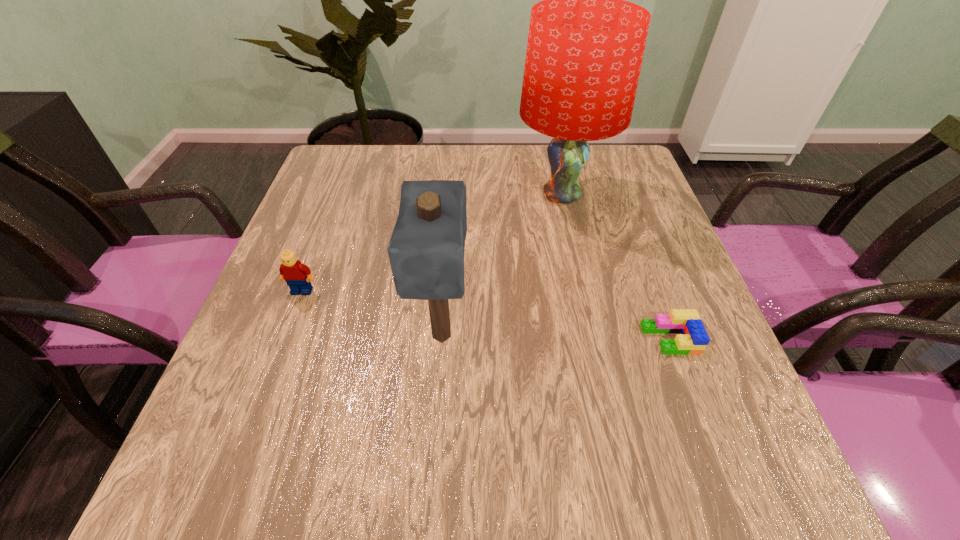
Image resolution: width=960 pixels, height=540 pixels. In order to click on free region located on the front-facing side of the second farthest object in this screenshot , I will do point(275,363).

I want to click on free space located on the front of the shortest object, so click(722, 481).

Find the location of a particular element. object that is positioned at the far edge is located at coordinates (585, 48).

The image size is (960, 540). Identify the location of object located in the left edge section of the desktop. (292, 271).

What are the coordinates of `lampshade located at the right edge` in the screenshot? It's located at pos(585,48).

Find the location of `Lego that is at the right edge`. Lego that is at the right edge is located at coordinates (693, 339).

The image size is (960, 540). What are the coordinates of `object present at the far right corner` in the screenshot? It's located at (585, 48).

In the image, there is a desktop. Where is `vacant space at the far edge`? The height and width of the screenshot is (540, 960). vacant space at the far edge is located at coordinates (390, 145).

You are a GUI agent. You are given a task and a screenshot of the screen. Output one action in this format:
    pyautogui.click(x=<x>, y=<y>)
    Task: Click on the vacant space at the near edge
    This screenshot has width=960, height=540.
    Given the screenshot: What is the action you would take?
    pyautogui.click(x=347, y=469)

Where is `vacant position at the left edge of the desktop`? vacant position at the left edge of the desktop is located at coordinates (300, 356).